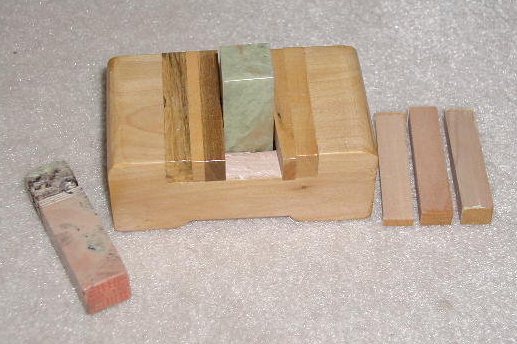
The image size is (517, 344). In order to click on carpet above object in this screenshot , I will do `click(236, 16)`.